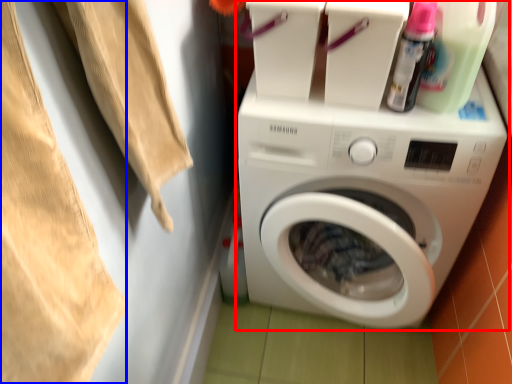
Question: Which object appears closest to the camera in this image, washing machine (highlighted by a red box) or clothing (highlighted by a blue box)?

Choices:
 (A) washing machine
 (B) clothing

Answer: (B)